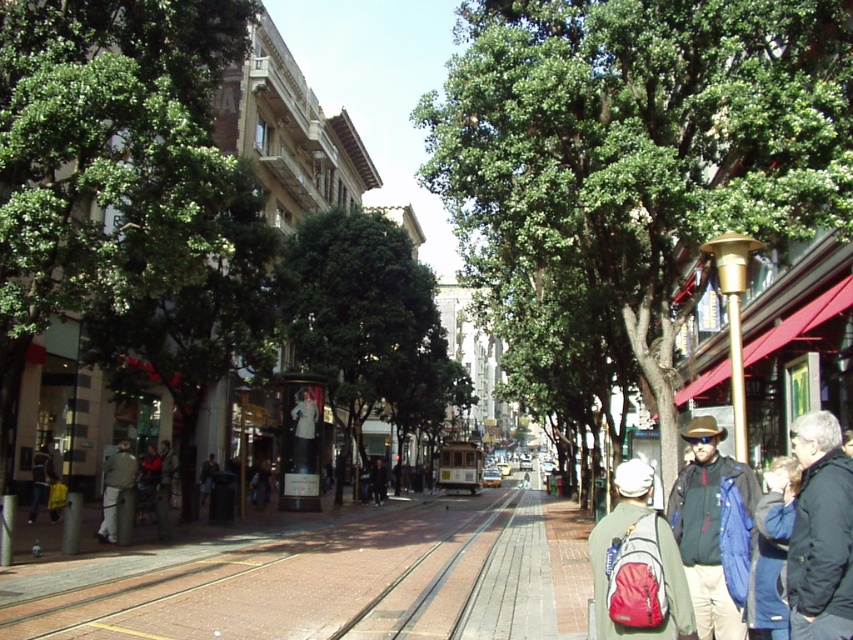
Question: Which point appears closest to the camera in this image?

Choices:
 (A) (392, 522)
 (B) (675, 595)
 (C) (746, 538)

Answer: (B)

Question: Is dark gray jacket at lower right wider than matte black jacket at lower right?

Choices:
 (A) no
 (B) yes

Answer: (A)

Question: Estimate the real-world distances between objects in this image. Which object is farther from the matte green jacket at center?

Choices:
 (A) light gray fabric jacket at center
 (B) matte black jacket at lower right

Answer: (A)

Question: Which object is the closest to the brick pavement at center?

Choices:
 (A) brick train track at center
 (B) red backpack at lower right
 (C) light gray fabric jacket at center
 (D) matte green jacket at center

Answer: (A)

Question: Is matte green jacket at center wider than brick train track at center?

Choices:
 (A) no
 (B) yes

Answer: (A)

Question: Is dark gray jacket at lower right further to the viewer compared to light gray fabric jacket at center?

Choices:
 (A) yes
 (B) no

Answer: (B)